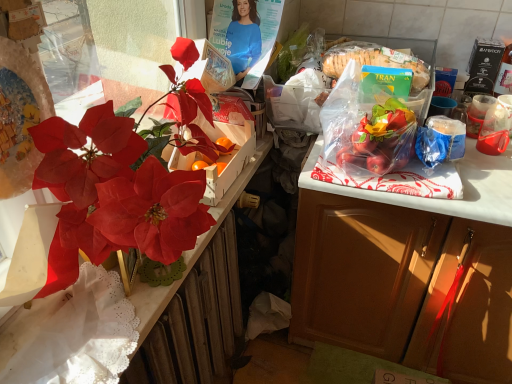
Question: Is white lace wrapping paper at left looking in the opposite direction of transparent plastic coffee cup at upper right, which is the second coffee cup in right-to-left order?

Choices:
 (A) yes
 (B) no

Answer: (B)

Question: Is white lace wrapping paper at left wider than transparent plastic coffee cup at upper right, which appears as the first coffee cup when viewed from the left?

Choices:
 (A) yes
 (B) no

Answer: (A)

Question: Would you say white lace wrapping paper at left is a long distance from transparent plastic coffee cup at upper right, which appears as the first coffee cup when viewed from the left?

Choices:
 (A) yes
 (B) no

Answer: (A)

Question: Is white lace wrapping paper at left in front of transparent plastic coffee cup at upper right, which appears as the first coffee cup when viewed from the left?

Choices:
 (A) no
 (B) yes

Answer: (B)

Question: Can transparent plastic coffee cup at upper right, which appears as the first coffee cup when viewed from the left, be found inside white lace wrapping paper at left?

Choices:
 (A) yes
 (B) no

Answer: (B)

Question: Considering their positions, is matte red flower at left located in front of or behind metallic radiator at left?

Choices:
 (A) front
 (B) behind

Answer: (A)

Question: Looking at the image, does matte red flower at left seem bigger or smaller compared to metallic radiator at left?

Choices:
 (A) big
 (B) small

Answer: (B)

Question: Considering the positions of matte red flower at left and metallic radiator at left in the image, is matte red flower at left wider or thinner than metallic radiator at left?

Choices:
 (A) wide
 (B) thin

Answer: (A)

Question: Considering the relative positions of matte red flower at left and metallic radiator at left in the image provided, is matte red flower at left to the left or to the right of metallic radiator at left?

Choices:
 (A) left
 (B) right

Answer: (A)

Question: Is point (506, 104) closer or farther from the camera than point (480, 292)?

Choices:
 (A) farther
 (B) closer

Answer: (B)

Question: From the image's perspective, is transparent plastic cup at right, the second coffee cup from the left, above or below matte brown cabinet at right?

Choices:
 (A) below
 (B) above

Answer: (B)

Question: Is transparent plastic cup at right, the 1th coffee cup viewed from the right, wider or thinner than matte brown cabinet at right?

Choices:
 (A) thin
 (B) wide

Answer: (A)

Question: In the image, is transparent plastic cup at right, the second coffee cup from the left, positioned in front of or behind matte brown cabinet at right?

Choices:
 (A) behind
 (B) front

Answer: (A)

Question: From the image's perspective, is matte brown cabinet at right above or below white lace wrapping paper at left?

Choices:
 (A) below
 (B) above

Answer: (B)

Question: Is matte brown cabinet at right inside the boundaries of white lace wrapping paper at left, or outside?

Choices:
 (A) outside
 (B) inside

Answer: (A)